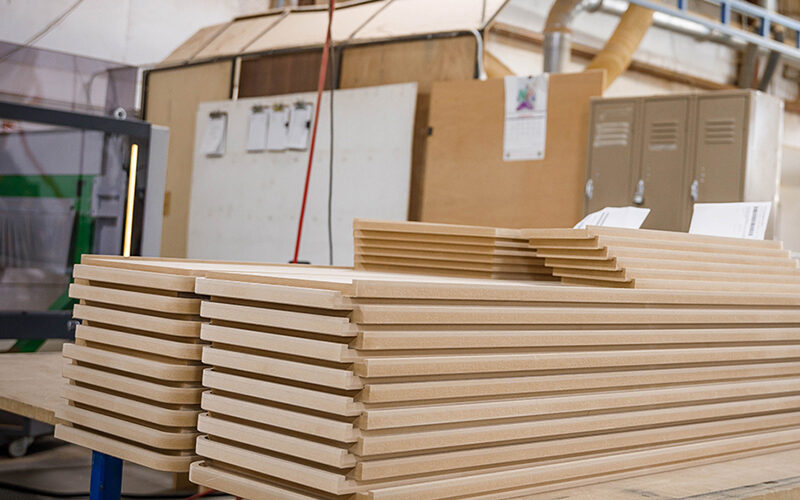
Locate an element on the screen. lockers is located at coordinates (624, 165), (710, 148), (656, 156).